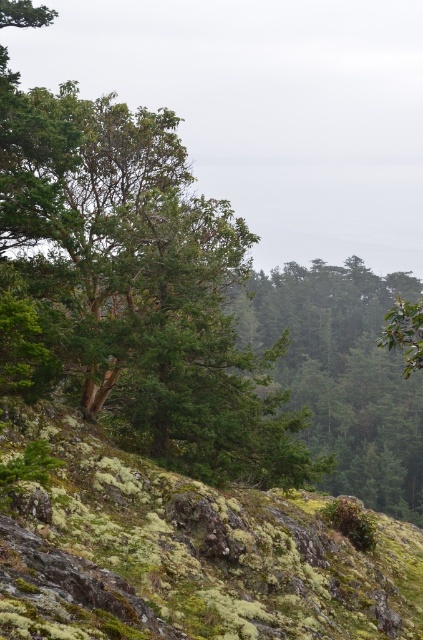
Question: Which of the following is the closest to the observer?

Choices:
 (A) (159, 584)
 (B) (342, 476)

Answer: (A)

Question: Does green mossy rock at center appear on the left side of green matte tree at center?

Choices:
 (A) yes
 (B) no

Answer: (A)

Question: Which point is closer to the camera?

Choices:
 (A) (293, 392)
 (B) (54, 525)

Answer: (B)

Question: Is green mossy rock at center closer to the viewer compared to green matte tree at center?

Choices:
 (A) no
 (B) yes

Answer: (B)

Question: Does green mossy rock at center appear on the left side of green matte tree at center?

Choices:
 (A) no
 (B) yes

Answer: (B)